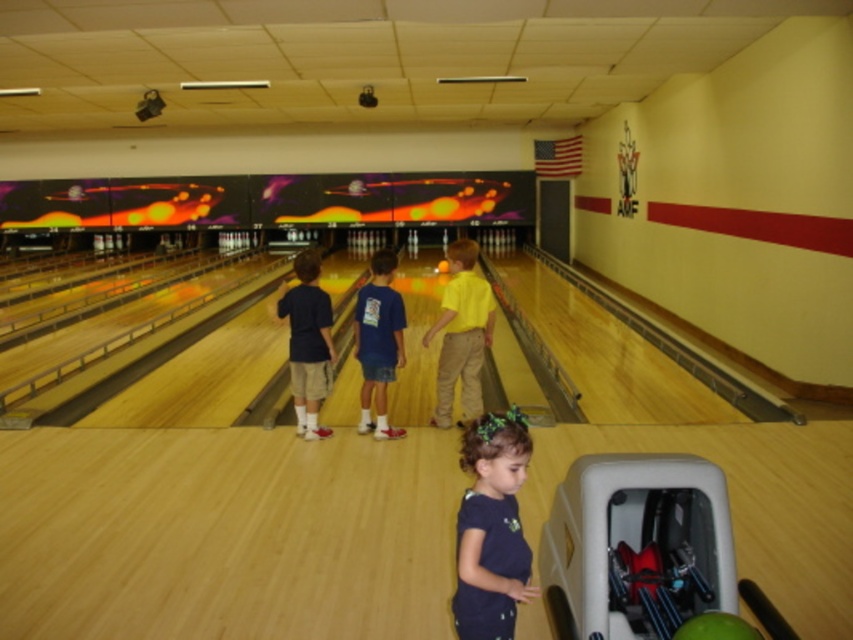
Please describe the exact position of the yellow matte shirt at center in the bowling alley scene using coordinates.

The yellow matte shirt at center is located at coordinates point [461,333].

You are a photographer positioned at the end of the bowling lane where the pins are located. You want to take a photo of the matte blue shirt at center and the green matte bowling ball at lower center so that both are clearly visible in the frame. Based on their positions, which object should you adjust your camera angle to focus on first to ensure both are in the shot?

The matte blue shirt at center is to the left of the green matte bowling ball at lower center. To capture both in the frame, adjust the camera angle to focus on the matte blue shirt at center first, as it is positioned further left, ensuring the green matte bowling ball at lower center remains within the right side of the frame.